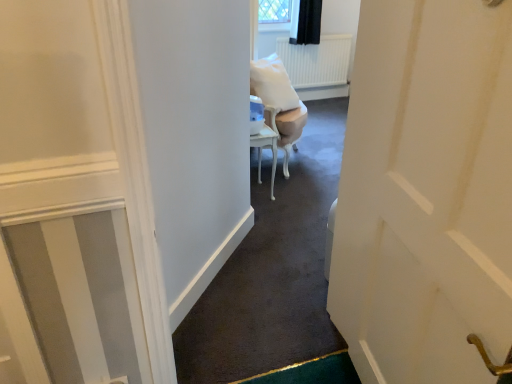
Find the location of a particular element. Image resolution: width=512 pixels, height=384 pixels. white glossy table at center is located at coordinates (266, 147).

What do you see at coordinates (266, 147) in the screenshot?
I see `white glossy table at center` at bounding box center [266, 147].

The height and width of the screenshot is (384, 512). I want to click on white glossy chair at center, so click(279, 102).

Describe the element at coordinates (279, 102) in the screenshot. The height and width of the screenshot is (384, 512). I see `white glossy chair at center` at that location.

This screenshot has width=512, height=384. Find the location of `white glossy table at center`. white glossy table at center is located at coordinates (266, 147).

Considering the positions of objects white glossy table at center and white glossy chair at center in the image provided, who is more to the right, white glossy table at center or white glossy chair at center?

Positioned to the right is white glossy chair at center.

Between white glossy table at center and white glossy chair at center, which one is positioned behind?

white glossy chair at center is more distant.

Which is further, (x=270, y=137) or (x=286, y=130)?

The point (x=286, y=130) is farther from the camera.

From the image's perspective, is white glossy table at center located above or below white glossy chair at center?

white glossy table at center is situated lower than white glossy chair at center in the image.

From a real-world perspective, is white glossy table at center above or below white glossy chair at center?

white glossy table at center is situated lower than white glossy chair at center in the real world.

Which of these two, white glossy table at center or white glossy chair at center, is wider?

white glossy chair at center is wider.

Between white glossy table at center and white glossy chair at center, which one has less height?

Standing shorter between the two is white glossy table at center.

Who is bigger, white glossy table at center or white glossy chair at center?

With larger size is white glossy chair at center.

Do you think white glossy table at center is within white glossy chair at center, or outside of it?

white glossy table at center is not enclosed by white glossy chair at center.

Is white glossy table at center in contact with white glossy chair at center?

white glossy table at center is not next to white glossy chair at center, and they're not touching.

Could you tell me if white glossy table at center is turned towards white glossy chair at center?

No, white glossy table at center is not facing towards white glossy chair at center.

Where is `furniture in front of the white glossy chair at center`? furniture in front of the white glossy chair at center is located at coordinates (266, 147).

Considering the relative positions of white glossy chair at center and white glossy table at center in the image provided, is white glossy chair at center to the right of white glossy table at center from the viewer's perspective?

Indeed, white glossy chair at center is positioned on the right side of white glossy table at center.

Is white glossy chair at center further to the viewer compared to white glossy table at center?

Yes, it is.

Considering the points (290, 128) and (272, 128), which point is in front, point (290, 128) or point (272, 128)?

The point (272, 128) is more forward.

From the image's perspective, between white glossy chair at center and white glossy table at center, who is located below?

white glossy table at center, from the image's perspective.

In the scene shown: From a real-world perspective, which is physically below, white glossy chair at center or white glossy table at center?

white glossy table at center.

Which object is wider, white glossy chair at center or white glossy table at center?

Wider between the two is white glossy chair at center.

Can you confirm if white glossy chair at center is taller than white glossy table at center?

Yes.

Which of these two, white glossy chair at center or white glossy table at center, is bigger?

white glossy chair at center.

Based on the photo, is white glossy chair at center completely or partially outside of white glossy table at center?

Yes, white glossy chair at center is located beyond the bounds of white glossy table at center.

Is white glossy chair at center positioned far away from white glossy table at center?

No.

In the scene shown: Could you tell me if white glossy chair at center is facing white glossy table at center?

No, white glossy chair at center is not turned towards white glossy table at center.

In the scene shown: Measure the distance from white glossy chair at center to white glossy table at center.

white glossy chair at center and white glossy table at center are 8.21 inches apart.

Where is `furniture that is on the left side of white glossy chair at center`? The image size is (512, 384). furniture that is on the left side of white glossy chair at center is located at coordinates (266, 147).

You are a GUI agent. You are given a task and a screenshot of the screen. Output one action in this format:
    pyautogui.click(x=<x>, y=<y>)
    Task: Click on the furniture located below the white glossy chair at center (from the image's perspective)
    The width and height of the screenshot is (512, 384).
    Given the screenshot: What is the action you would take?
    pyautogui.click(x=266, y=147)

Identify the location of chair on the right of white glossy table at center. The height and width of the screenshot is (384, 512). point(279,102).